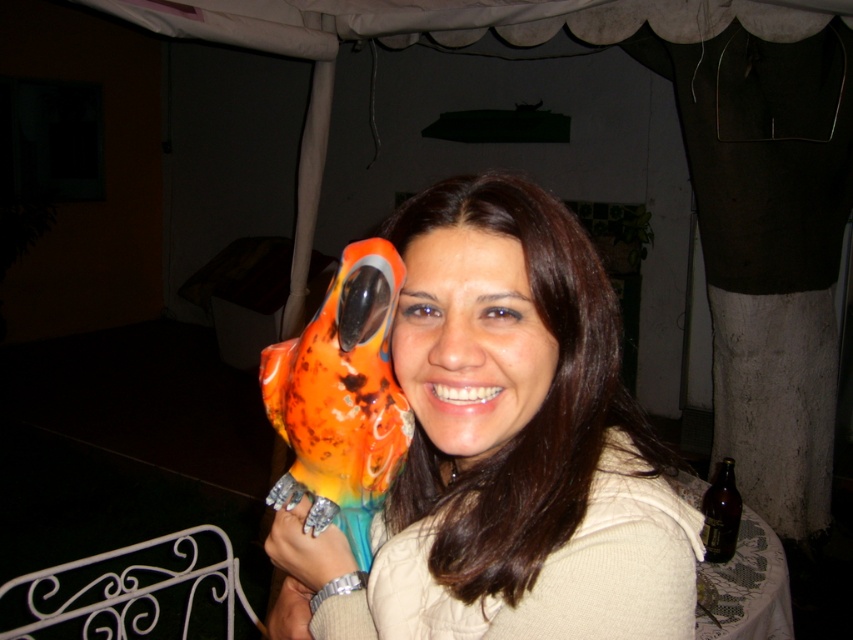
Does point (502, 308) lie in front of point (347, 305)?

No, (502, 308) is further to viewer.

How distant is matte ceramic parrot at center from shiny plastic parrot at left?

matte ceramic parrot at center is 3.37 inches from shiny plastic parrot at left.

Where is `matte ceramic parrot at center`? matte ceramic parrot at center is located at coordinates (512, 444).

This screenshot has height=640, width=853. Find the location of `matte ceramic parrot at center`. matte ceramic parrot at center is located at coordinates (512, 444).

Based on the photo, does matte ceramic parrot at center appear over metallic ring at center?

Yes.

Is matte ceramic parrot at center positioned before metallic ring at center?

Yes, matte ceramic parrot at center is in front of metallic ring at center.

Locate an element on the screen. matte ceramic parrot at center is located at coordinates (512, 444).

In the scene shown: Does shiny plastic parrot at left appear under metallic ring at center?

No, shiny plastic parrot at left is not below metallic ring at center.

Between point (302, 340) and point (291, 557), which one is positioned behind?

Point (291, 557)

Locate an element on the screen. shiny plastic parrot at left is located at coordinates (341, 400).